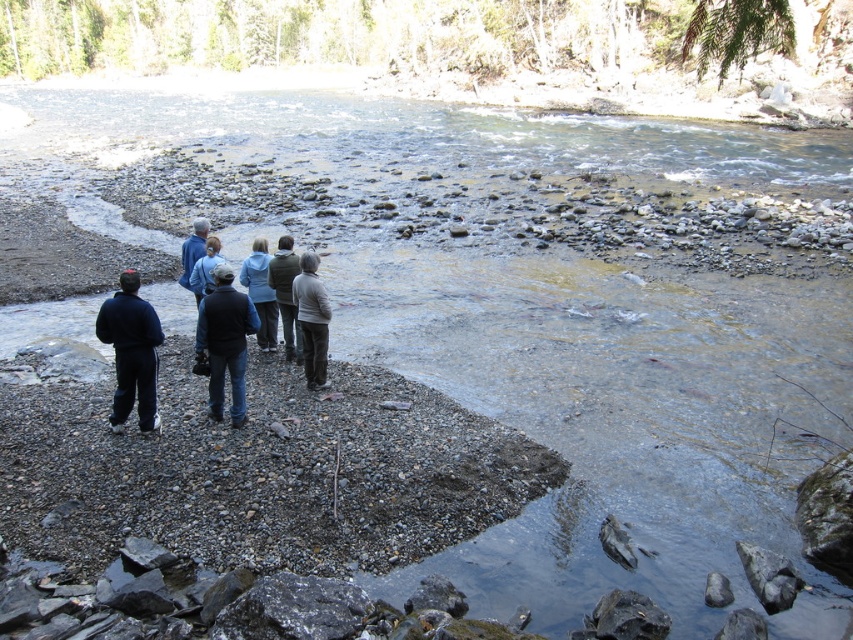
You are a hiker who wants to determine which clothing item is taller between the blue fleece jacket at center and the light brown sweater at center. Based on the scene, which one is taller?

The blue fleece jacket at center is taller than the light brown sweater at center.

You are a hiker who wants to know which jacket is easier to pack in a small backpack. Based on the scene, which jacket between the dark blue jacket at center and the blue denim jacket at center would you choose?

The dark blue jacket at center is thinner than the blue denim jacket at center, so it would be easier to pack in a small backpack.